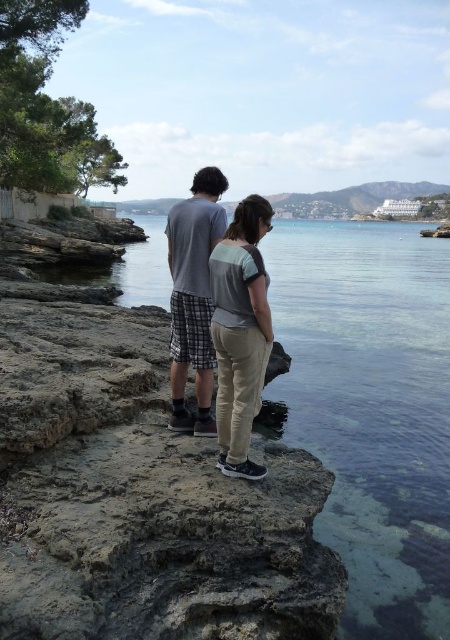
Question: Does clear water at center have a greater width compared to gray cotton t-shirt at center?

Choices:
 (A) no
 (B) yes

Answer: (B)

Question: Which point is farther to the camera?

Choices:
 (A) light gray cotton pants at center
 (B) clear water at center
 (C) gray cotton t-shirt at center

Answer: (C)

Question: Which point is closer to the camera?

Choices:
 (A) (424, 513)
 (B) (171, 388)

Answer: (B)

Question: Does clear water at center have a larger size compared to light gray cotton pants at center?

Choices:
 (A) yes
 (B) no

Answer: (A)

Question: Which point is closer to the camera taking this photo?

Choices:
 (A) (225, 392)
 (B) (316, 337)
 (C) (207, 394)

Answer: (A)

Question: Is clear water at center behind gray cotton t-shirt at center?

Choices:
 (A) no
 (B) yes

Answer: (A)